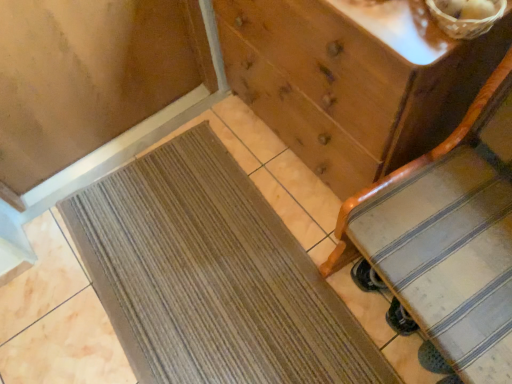
Question: Is the depth of brown woven mat at lower left less than that of wooden chest of drawers at center?

Choices:
 (A) no
 (B) yes

Answer: (A)

Question: Considering the relative sizes of brown woven mat at lower left and wooden chest of drawers at center in the image provided, is brown woven mat at lower left smaller than wooden chest of drawers at center?

Choices:
 (A) yes
 (B) no

Answer: (A)

Question: Is brown woven mat at lower left not within wooden chest of drawers at center?

Choices:
 (A) no
 (B) yes

Answer: (B)

Question: Does brown woven mat at lower left have a lesser height compared to wooden chest of drawers at center?

Choices:
 (A) no
 (B) yes

Answer: (B)

Question: Is brown woven mat at lower left at the right side of wooden chest of drawers at center?

Choices:
 (A) no
 (B) yes

Answer: (A)

Question: From their relative heights in the image, would you say wooden chest of drawers at center is taller or shorter than brown woven basket at upper right?

Choices:
 (A) short
 (B) tall

Answer: (B)

Question: Is wooden chest of drawers at center wider or thinner than brown woven basket at upper right?

Choices:
 (A) thin
 (B) wide

Answer: (B)

Question: From the image's perspective, is wooden chest of drawers at center located above or below brown woven basket at upper right?

Choices:
 (A) above
 (B) below

Answer: (A)

Question: From a real-world perspective, is wooden chest of drawers at center positioned above or below brown woven basket at upper right?

Choices:
 (A) above
 (B) below

Answer: (B)

Question: Looking at the image, does brown woven mat at lower left seem bigger or smaller compared to striped fabric suitcase at right?

Choices:
 (A) big
 (B) small

Answer: (B)

Question: From their relative heights in the image, would you say brown woven mat at lower left is taller or shorter than striped fabric suitcase at right?

Choices:
 (A) tall
 (B) short

Answer: (B)

Question: From a real-world perspective, is brown woven mat at lower left positioned above or below striped fabric suitcase at right?

Choices:
 (A) below
 (B) above

Answer: (A)

Question: From the image's perspective, is brown woven mat at lower left located above or below striped fabric suitcase at right?

Choices:
 (A) above
 (B) below

Answer: (B)

Question: Is striped fabric suitcase at right inside or outside of brown woven basket at upper right?

Choices:
 (A) inside
 (B) outside

Answer: (B)

Question: Would you say striped fabric suitcase at right is to the left or to the right of brown woven basket at upper right in the picture?

Choices:
 (A) left
 (B) right

Answer: (B)